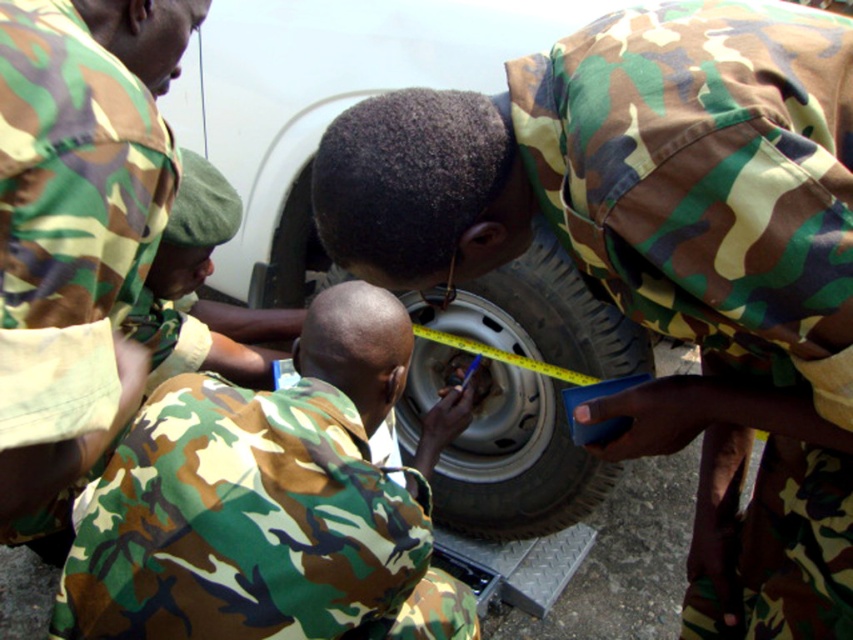
Can you confirm if camouflage fabric uniform at lower center is thinner than silver metallic wheel at center?

Incorrect, camouflage fabric uniform at lower center's width is not less than silver metallic wheel at center's.

Which is behind, point (401, 378) or point (444, 513)?

The point (444, 513) is behind.

This screenshot has height=640, width=853. I want to click on camouflage fabric uniform at lower center, so click(x=271, y=502).

Is camouflage fabric uniform at center closer to the viewer compared to camouflage fabric uniform at left?

That is False.

This screenshot has height=640, width=853. What do you see at coordinates (662, 259) in the screenshot?
I see `camouflage fabric uniform at center` at bounding box center [662, 259].

Identify the location of camouflage fabric uniform at center. The height and width of the screenshot is (640, 853). (662, 259).

Is camouflage fabric uniform at left behind silver metallic wheel at center?

No.

Between point (38, 106) and point (421, 381), which one is positioned in front?

Point (38, 106)

What are the coordinates of `camouflage fabric uniform at left` in the screenshot? It's located at (77, 225).